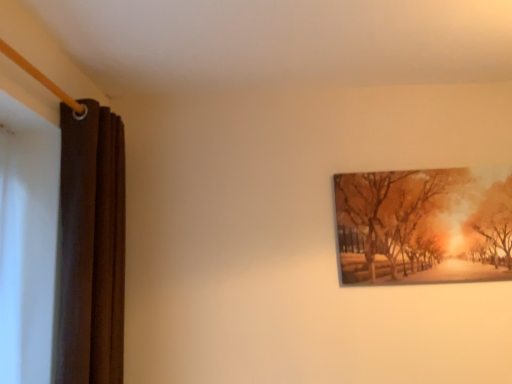
Question: Is the position of matte wooden picture frame at upper right less distant than that of brown velvet curtain at left?

Choices:
 (A) yes
 (B) no

Answer: (B)

Question: Would you say matte wooden picture frame at upper right is outside brown velvet curtain at left?

Choices:
 (A) yes
 (B) no

Answer: (A)

Question: Does matte wooden picture frame at upper right have a smaller size compared to brown velvet curtain at left?

Choices:
 (A) no
 (B) yes

Answer: (B)

Question: From the image's perspective, is matte wooden picture frame at upper right beneath brown velvet curtain at left?

Choices:
 (A) no
 (B) yes

Answer: (A)

Question: From a real-world perspective, is matte wooden picture frame at upper right beneath brown velvet curtain at left?

Choices:
 (A) yes
 (B) no

Answer: (B)

Question: Considering the relative positions of matte wooden picture frame at upper right and brown velvet curtain at left in the image provided, is matte wooden picture frame at upper right to the left of brown velvet curtain at left from the viewer's perspective?

Choices:
 (A) no
 (B) yes

Answer: (A)

Question: Is brown velvet curtain at left shorter than matte wooden picture frame at upper right?

Choices:
 (A) yes
 (B) no

Answer: (B)

Question: Can you confirm if brown velvet curtain at left is wider than matte wooden picture frame at upper right?

Choices:
 (A) yes
 (B) no

Answer: (A)

Question: From a real-world perspective, is brown velvet curtain at left positioned under matte wooden picture frame at upper right based on gravity?

Choices:
 (A) no
 (B) yes

Answer: (B)

Question: Considering the relative sizes of brown velvet curtain at left and matte wooden picture frame at upper right in the image provided, is brown velvet curtain at left thinner than matte wooden picture frame at upper right?

Choices:
 (A) no
 (B) yes

Answer: (A)

Question: Does brown velvet curtain at left have a smaller size compared to matte wooden picture frame at upper right?

Choices:
 (A) yes
 (B) no

Answer: (B)

Question: Considering the relative positions of brown velvet curtain at left and matte wooden picture frame at upper right in the image provided, is brown velvet curtain at left in front of matte wooden picture frame at upper right?

Choices:
 (A) no
 (B) yes

Answer: (B)

Question: From their relative heights in the image, would you say matte wooden picture frame at upper right is taller or shorter than brown velvet curtain at left?

Choices:
 (A) short
 (B) tall

Answer: (A)